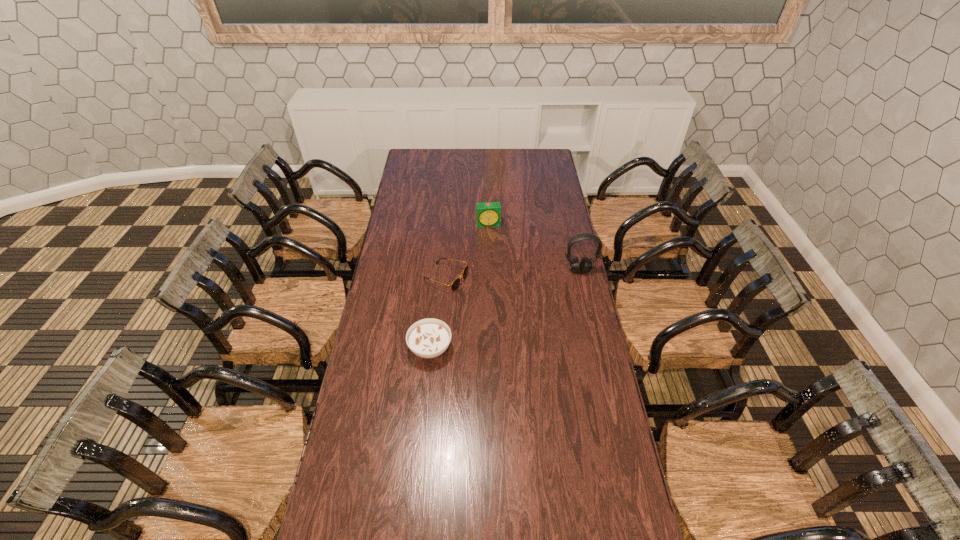
Where is `blank region between the soup bowl and the rightmost object`? The width and height of the screenshot is (960, 540). blank region between the soup bowl and the rightmost object is located at coordinates (505, 309).

Locate which object ranks in proximity to the farthest object. Please provide its 2D coordinates. Your answer should be formatted as a tuple, i.e. [(x, y)], where the tuple contains the x and y coordinates of a point satisfying the conditions above.

[(455, 284)]

What are the coordinates of `object that stands as the third closest to the second shortest object` in the screenshot? It's located at (488, 214).

You are a GUI agent. You are given a task and a screenshot of the screen. Output one action in this format:
    pyautogui.click(x=<x>, y=<y>)
    Task: Click on the free spot that satisfies the following two spatial constraints: 1. on the back side of the alarm clock; 2. on the right side of the sunglasses
    
    Given the screenshot: What is the action you would take?
    pyautogui.click(x=450, y=224)

I want to click on free space that satisfies the following two spatial constraints: 1. on the back side of the second shortest object; 2. on the right side of the shortest object, so click(x=437, y=278).